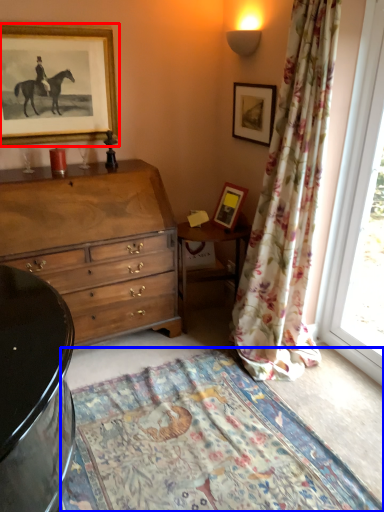
Question: Which point is further to the camera, picture frame (highlighted by a red box) or blanket (highlighted by a blue box)?

Choices:
 (A) picture frame
 (B) blanket

Answer: (A)